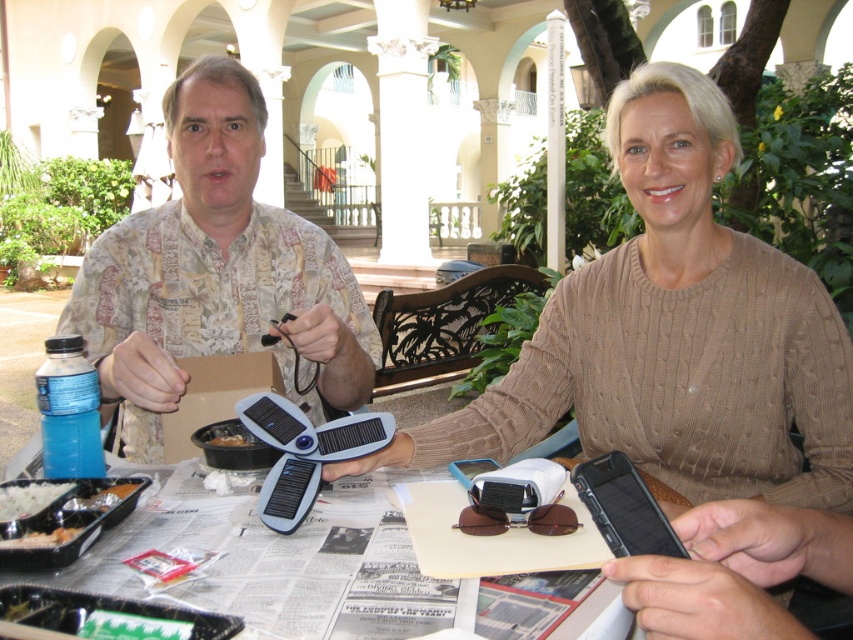
Question: Is matte floral shirt at center to the right of white matte rice at lower left from the viewer's perspective?

Choices:
 (A) no
 (B) yes

Answer: (A)

Question: Which point is closer to the camera?

Choices:
 (A) black plastic tray at lower left
 (B) knitted beige sweater at center

Answer: (A)

Question: From the image, what is the correct spatial relationship of matte floral shirt at center in relation to brown paper bag at center?

Choices:
 (A) above
 (B) below

Answer: (A)

Question: Which point is farther to the camera?

Choices:
 (A) black plastic tray at lower left
 (B) knitted beige sweater at center

Answer: (B)

Question: Estimate the real-world distances between objects in this image. Which object is closer to the knitted beige sweater at center?

Choices:
 (A) white paper at center
 (B) white matte rice at lower left

Answer: (A)

Question: Is black plastic tray at lower left bigger than white matte rice at lower left?

Choices:
 (A) yes
 (B) no

Answer: (A)